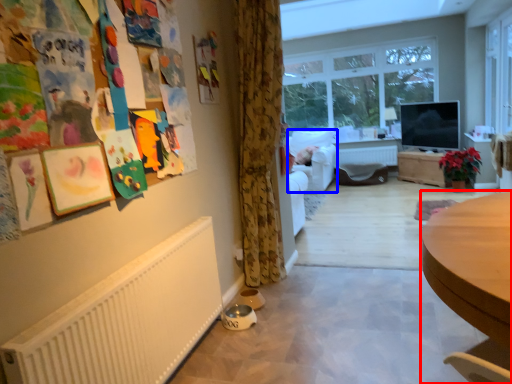
Question: Among these objects, which one is nearest to the camera, desk (highlighted by a red box) or armchair (highlighted by a blue box)?

Choices:
 (A) desk
 (B) armchair

Answer: (A)